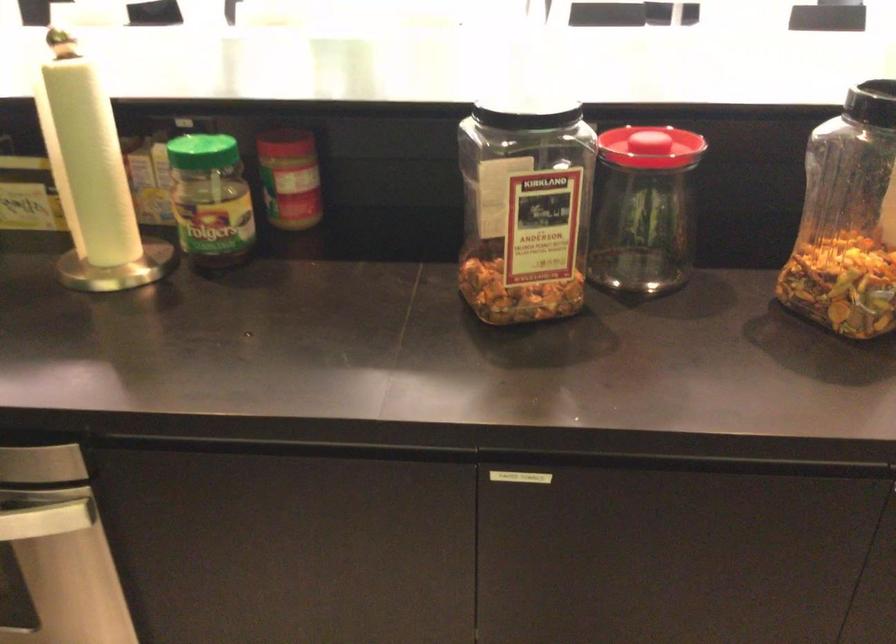
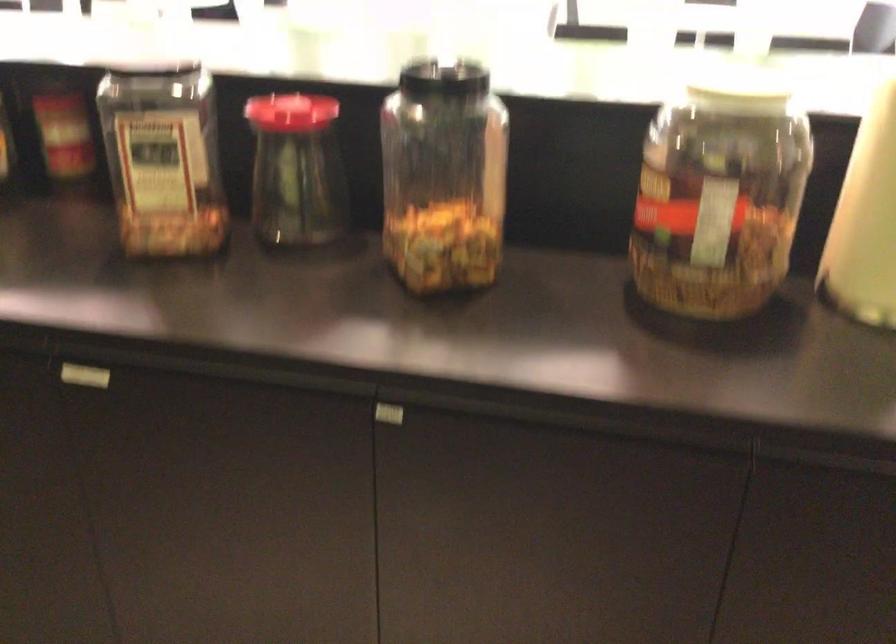
Locate, in the second image, the point that corresponds to (651,138) in the first image.

(290, 111)